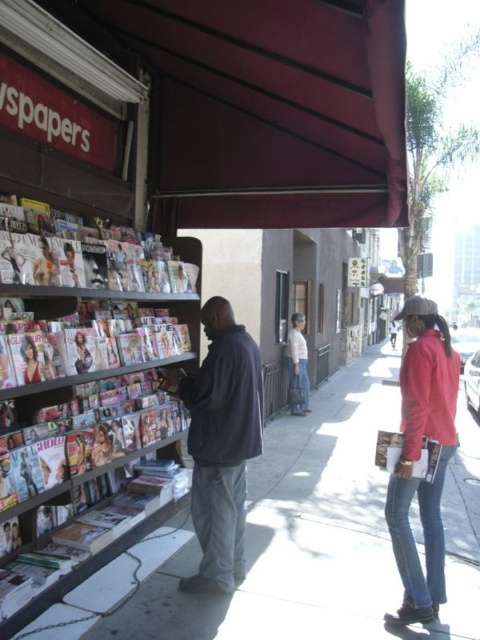
Can you confirm if red leather jacket at right is thinner than light beige pants at center?

In fact, red leather jacket at right might be wider than light beige pants at center.

Is red leather jacket at right shorter than light beige pants at center?

Incorrect, red leather jacket at right's height does not fall short of light beige pants at center's.

This screenshot has height=640, width=480. What do you see at coordinates (420, 454) in the screenshot?
I see `red leather jacket at right` at bounding box center [420, 454].

Identify the location of red leather jacket at right. (420, 454).

Is metallic glossy magazines at left above dark gray jacket at center?

Yes.

Which is more to the left, metallic glossy magazines at left or dark gray jacket at center?

metallic glossy magazines at left is more to the left.

Who is more distant from viewer, [15,408] or [207,456]?

Point [207,456]

Locate an element on the screen. metallic glossy magazines at left is located at coordinates (84, 403).

How distant is smooth concrete sidewalk at lower left from light beige pants at center?

5.77 feet

Is smooth concrete sidewalk at lower left closer to camera compared to light beige pants at center?

Yes.

Does point (285, 595) come closer to viewer compared to point (302, 326)?

Yes, point (285, 595) is closer to viewer.

Image resolution: width=480 pixels, height=640 pixels. Find the location of `smooth concrete sidewalk at lower left`. smooth concrete sidewalk at lower left is located at coordinates (297, 531).